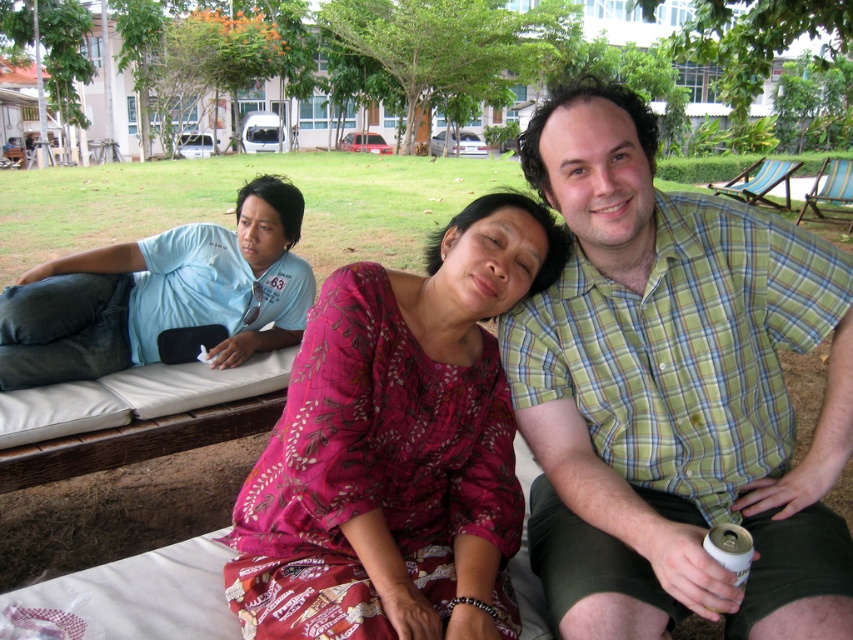
Measure the distance from green plaid shirt at center to pink printed dress at center.

A distance of 25.02 centimeters exists between green plaid shirt at center and pink printed dress at center.

Does point (759, 348) lie behind point (273, 636)?

That is True.

This screenshot has height=640, width=853. I want to click on green plaid shirt at center, so click(x=672, y=392).

Is pink printed dress at center shorter than blue t-shirt at left?

Incorrect, pink printed dress at center's height does not fall short of blue t-shirt at left's.

Can you confirm if pink printed dress at center is wider than blue t-shirt at left?

No.

Is point (462, 346) positioned after point (241, 262)?

No.

You are a GUI agent. You are given a task and a screenshot of the screen. Output one action in this format:
    pyautogui.click(x=<x>, y=<y>)
    Task: Click on the pink printed dress at center
    
    Given the screenshot: What is the action you would take?
    pyautogui.click(x=396, y=448)

Is green plaid shirt at center shorter than blue t-shirt at left?

No, green plaid shirt at center is not shorter than blue t-shirt at left.

Between green plaid shirt at center and blue t-shirt at left, which one appears on the right side from the viewer's perspective?

green plaid shirt at center is more to the right.

Which is in front, point (653, 365) or point (167, 358)?

Point (653, 365) is more forward.

Identify the location of green plaid shirt at center. This screenshot has height=640, width=853. (672, 392).